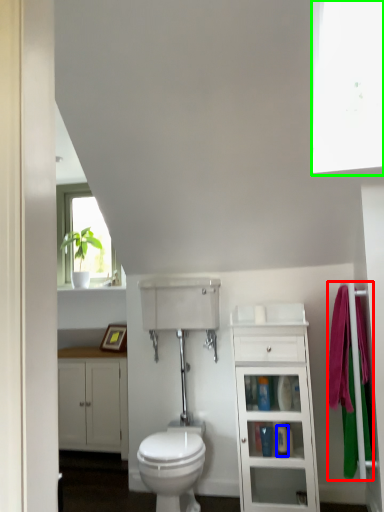
Question: Considering the real-world distances, which object is closest to bath towel (highlighted by a red box)? toiletry (highlighted by a blue box) or window screen (highlighted by a green box).

Choices:
 (A) toiletry
 (B) window screen

Answer: (A)